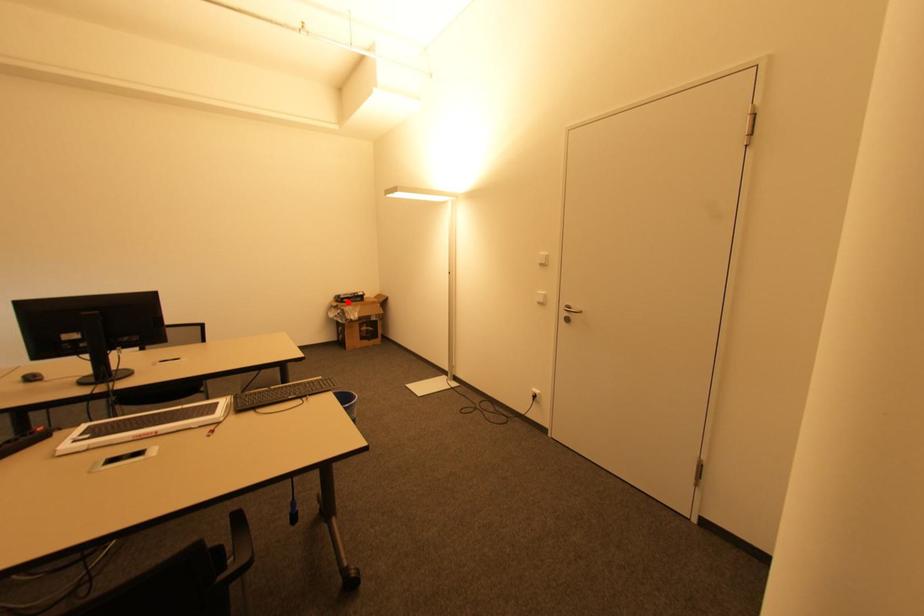
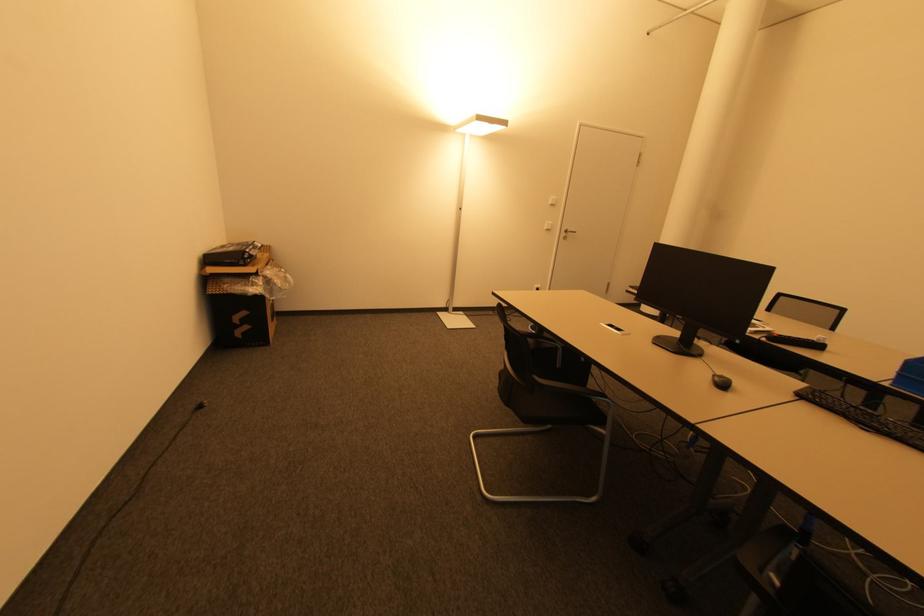
The point at the highlighted location is marked in the first image. Where is the corresponding point in the second image?

(251, 262)